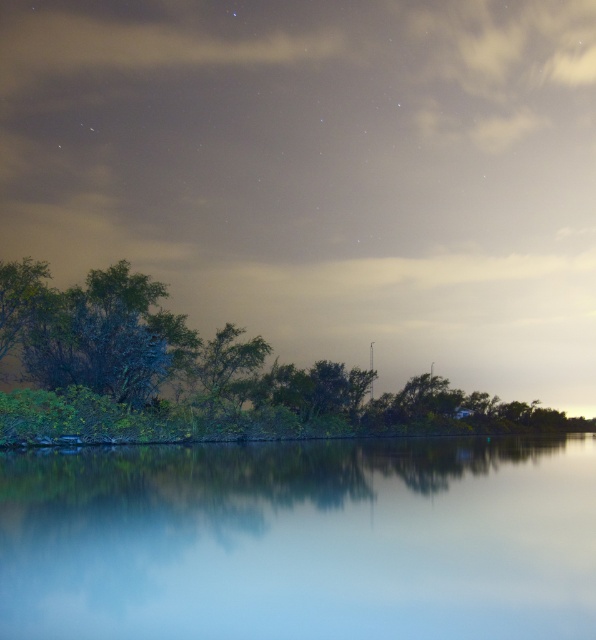
You are an artist trying to paint the scene. You need to decide which object to paint first based on their sizes. Which object should you paint first, the transparent glass water at center or the green leafy trees at left?

The transparent glass water at center has a smaller size compared to green leafy trees at left, so you should paint the green leafy trees at left first as they are larger and form the main structure of the scene.

From the picture: You are an astronomer analyzing the image of the night scene. You notice the transparent glass water at center. Based on its 2D coordinates, can you determine if it is positioned closer to the top or bottom of the image?

The transparent glass water at center is located at point 0.844 on the x axis and 0.507 on the y axis. Since the y coordinate is 0.507, which is closer to 0.5 than 0 or 1, it is positioned near the center vertically, neither closer to the top nor the bottom of the image.

You are standing at the edge of the water in the nighttime scene. There is a point marked at coordinates (302, 540). What object does this point correspond to?

The point at coordinates (302, 540) corresponds to the transparent glass water at center.